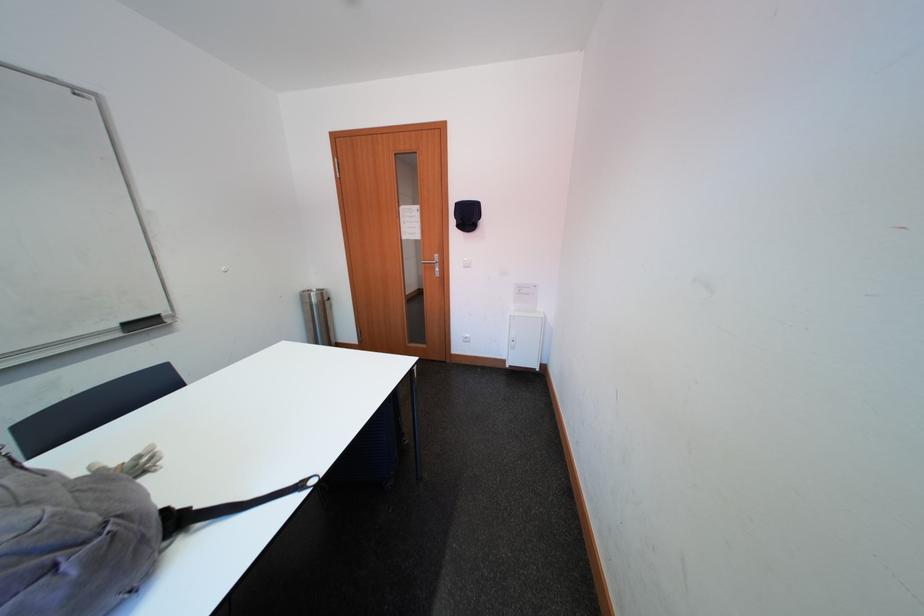
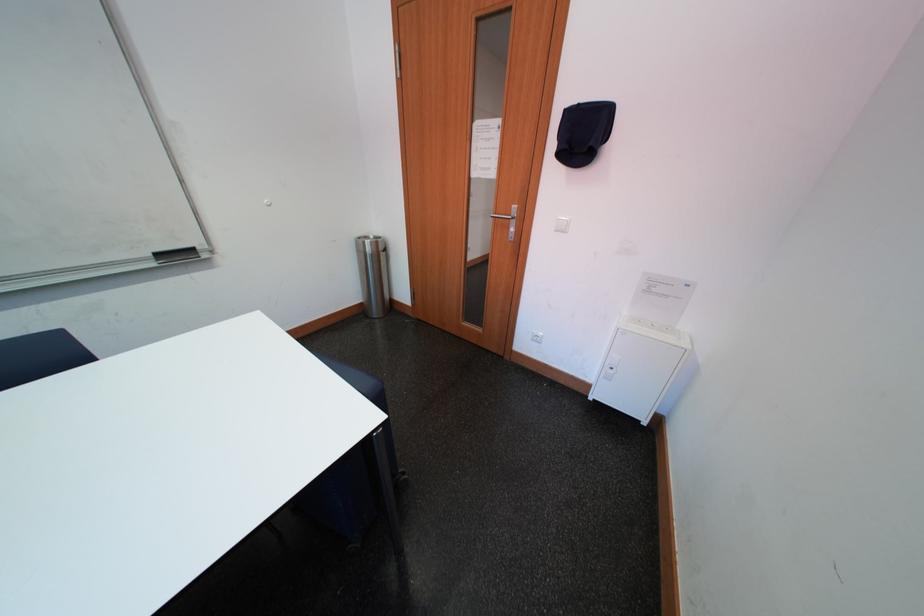
The point at (478, 220) is marked in the first image. Where is the corresponding point in the second image?

(593, 140)